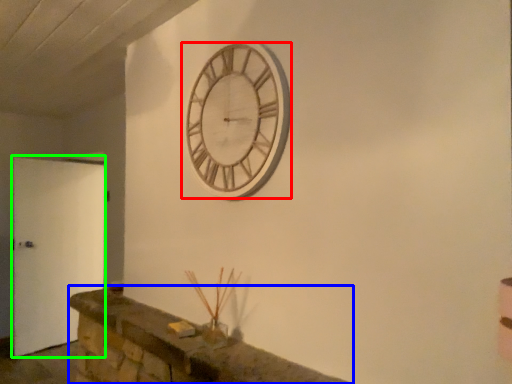
Question: Considering the real-world distances, which object is closest to wall clock (highlighted by a red box)? mantle (highlighted by a blue box) or door (highlighted by a green box).

Choices:
 (A) mantle
 (B) door

Answer: (A)